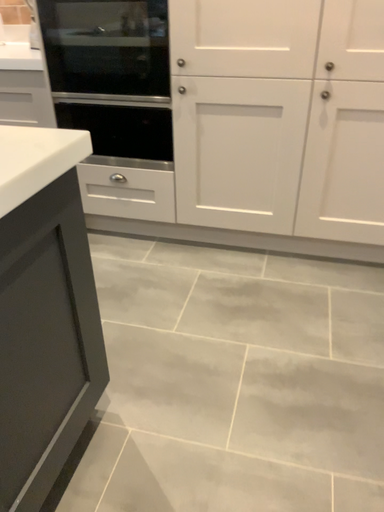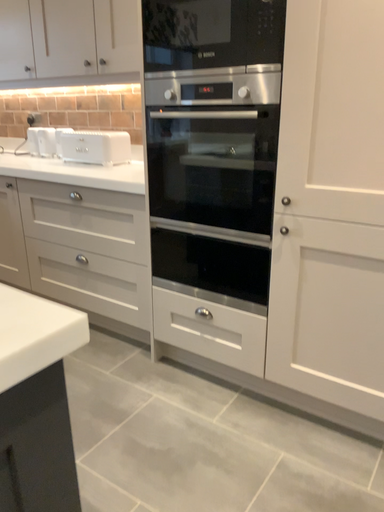
Question: Which way did the camera rotate in the video?

Choices:
 (A) rotated downward
 (B) rotated upward

Answer: (B)